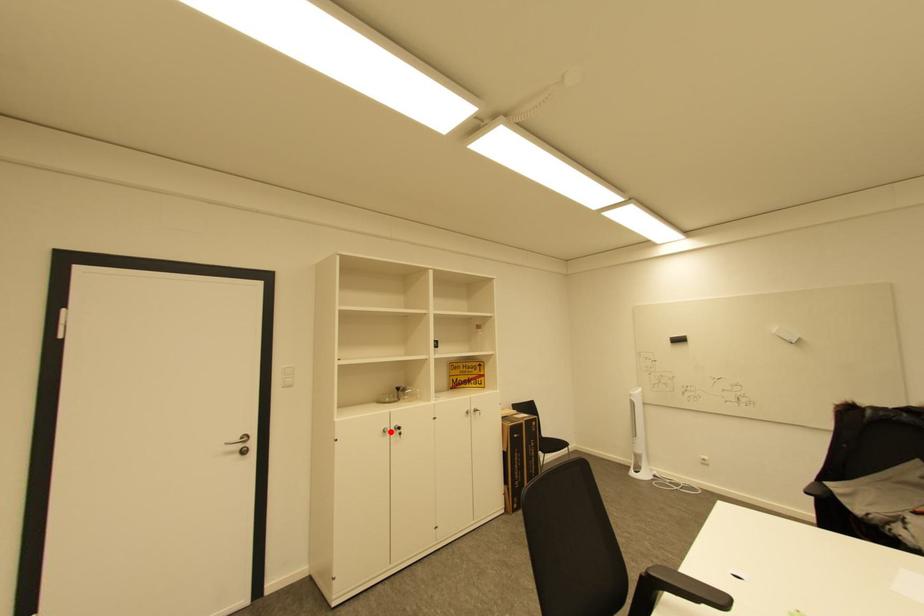
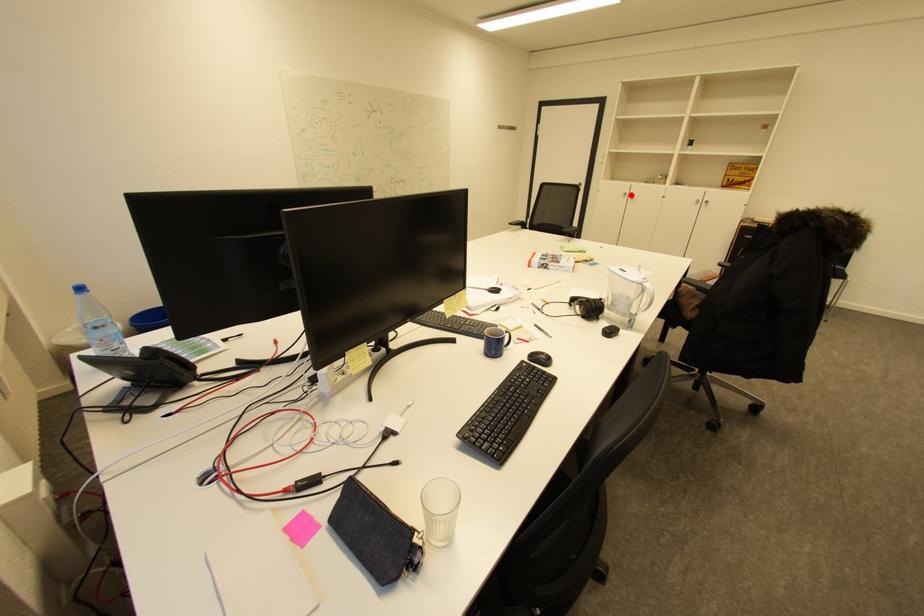
I am providing you with two images of the same scene from different viewpoints. A red point is marked on the first image and another point is marked on the second image. Is the marked point in image1 the same physical position as the marked point in image2?

Yes